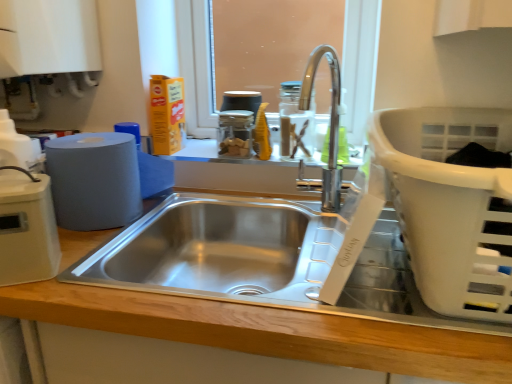
Question: Is point [350, 321] positioned closer to the camera than point [52, 142]?

Choices:
 (A) closer
 (B) farther

Answer: (A)

Question: Is wooden counter at center wider or thinner than matte gray paper towel at left?

Choices:
 (A) wide
 (B) thin

Answer: (A)

Question: Considering the real-world distances, which object is closest to the matte gray paper towel at left?

Choices:
 (A) beige plastic toaster at left, the first appliance when ordered from left to right
 (B) transparent glass window screen at upper center
 (C) clear glass jar at center
 (D) white plastic laundry basket at right
 (E) clear glass jar at center

Answer: (A)

Question: Which object is the farthest from the matte gray paper towel at left?

Choices:
 (A) clear glass jar at center
 (B) transparent glass window screen at upper center
 (C) clear glass jar at center
 (D) transparent glass jar at center, which is the second appliance from left to right
 (E) wooden counter at center

Answer: (B)